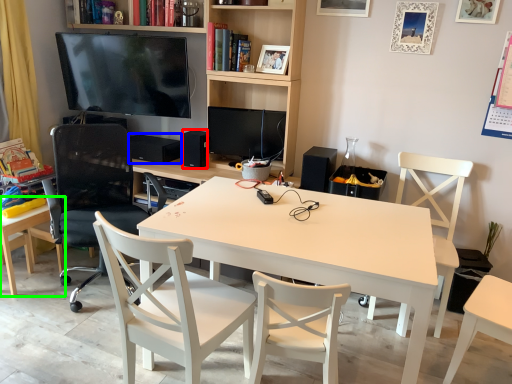
Question: Which object is the farthest from speaker (highlighted by a red box)? Choose among these: speaker (highlighted by a blue box) or desk (highlighted by a green box).

Choices:
 (A) speaker
 (B) desk

Answer: (B)